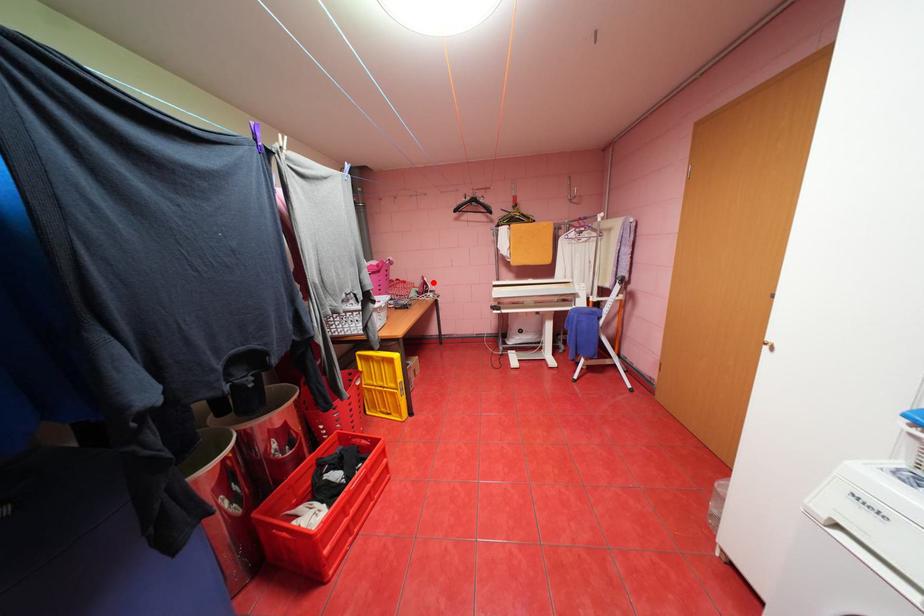
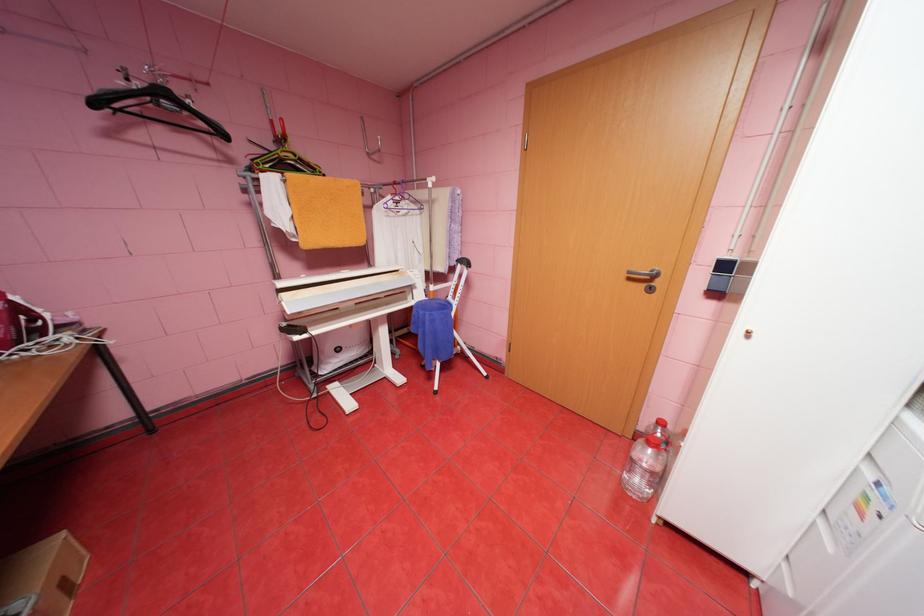
Locate, in the second image, the point that corresponds to the highlighted location in the first image.

(26, 309)